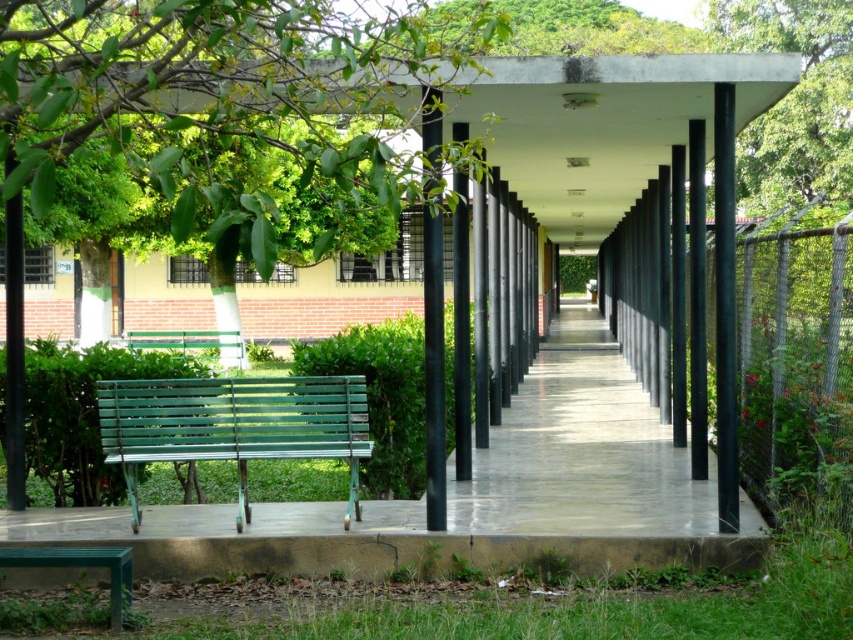
You are standing at the entrance of the corridor and see the green leafy tree at upper left and the green painted wood bench at center. Which object is positioned more to the left side of the corridor?

The green leafy tree at upper left is positioned more to the left side of the corridor compared to the green painted wood bench at center.

You are a landscape architect planning to add a new bench to the corridor. The existing green painted wood bench at center is currently under the shade of the green leafy tree at upper left. If you want the new bench to also be in the shade, where should you place it?

The green leafy tree at upper left is bigger than the green painted wood bench at center, so placing the new bench under the shade of the green leafy tree at upper left would ensure it stays shaded.